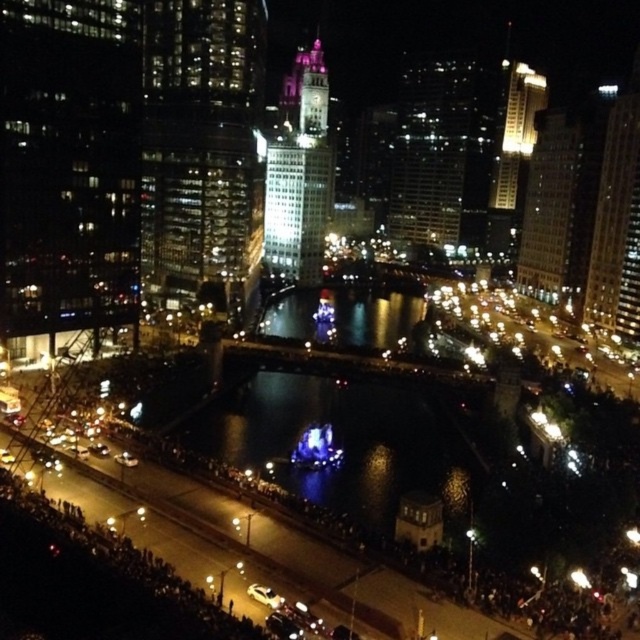
Is point (196, 243) positioned before point (280, 200)?

That is True.

Who is positioned more to the right, glassy reflective skyscraper at upper left or shiny glass tower at center?

shiny glass tower at center

This screenshot has width=640, height=640. What are the coordinates of `glassy reflective skyscraper at upper left` in the screenshot? It's located at pos(202,150).

Identify the location of glassy reflective skyscraper at upper left. Image resolution: width=640 pixels, height=640 pixels. (202, 150).

Does point (260, 410) come behind point (500, 124)?

No, it is in front of (500, 124).

Who is more forward, (253, 454) or (509, 67)?

Positioned in front is point (253, 454).

This screenshot has width=640, height=640. I want to click on dark reflective water at center, so 340,442.

Does glassy reflective skyscraper at upper left appear on the right side of matte glass skyscraper at upper right?

Incorrect, glassy reflective skyscraper at upper left is not on the right side of matte glass skyscraper at upper right.

Who is positioned more to the left, glassy reflective skyscraper at upper left or matte glass skyscraper at upper right?

From the viewer's perspective, glassy reflective skyscraper at upper left appears more on the left side.

Is point (150, 54) positioned behind point (616, 218)?

No, (150, 54) is in front of (616, 218).

You are a GUI agent. You are given a task and a screenshot of the screen. Output one action in this format:
    pyautogui.click(x=<x>, y=<y>)
    Task: Click on the glassy reflective skyscraper at upper left
    
    Given the screenshot: What is the action you would take?
    pyautogui.click(x=202, y=150)